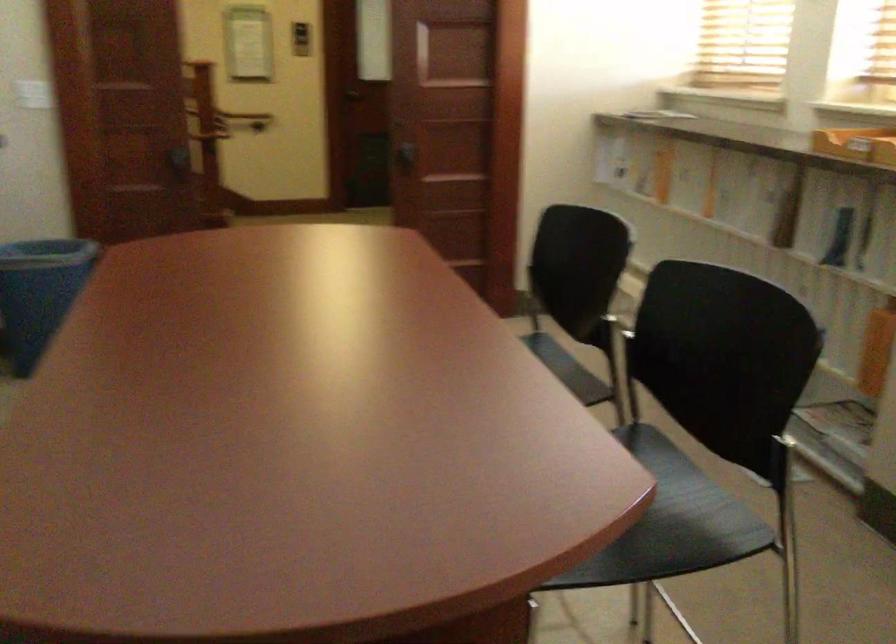
This screenshot has width=896, height=644. What do you see at coordinates (460, 133) in the screenshot?
I see `the dark door handle` at bounding box center [460, 133].